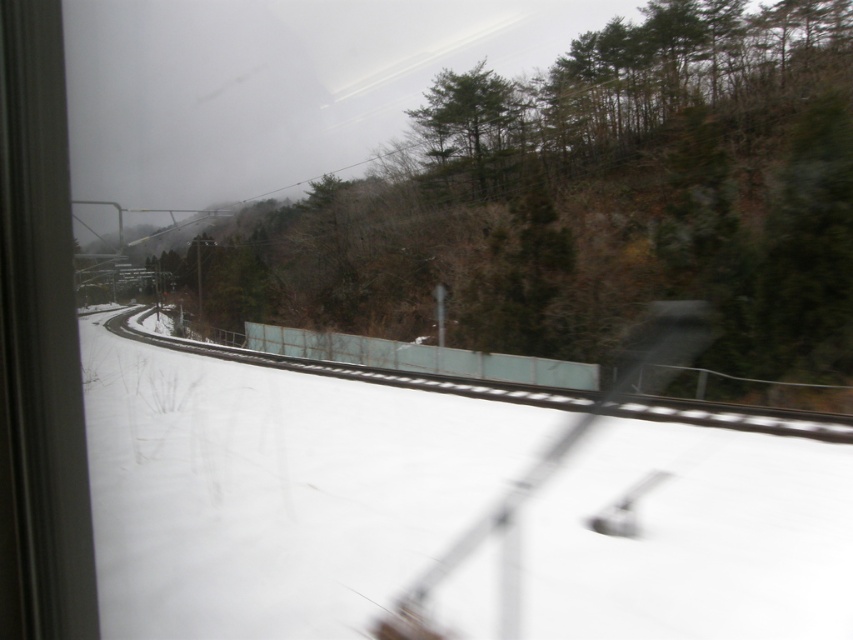
Question: Can you confirm if white snow at center is positioned above green matte tree at upper center?

Choices:
 (A) no
 (B) yes

Answer: (A)

Question: Which point is farther to the camera?

Choices:
 (A) green matte tree at upper center
 (B) white snow at center

Answer: (A)

Question: Where is white snow at center located in relation to green matte tree at upper center in the image?

Choices:
 (A) left
 (B) right

Answer: (A)

Question: Can you confirm if white snow at center is smaller than green matte tree at upper center?

Choices:
 (A) yes
 (B) no

Answer: (A)